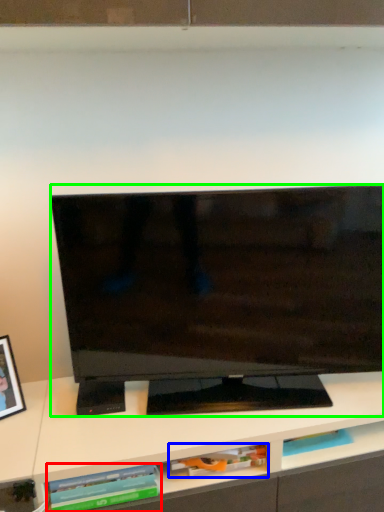
Question: Based on their relative distances, which object is nearer to book (highlighted by a red box)? Choose from book (highlighted by a blue box) and television (highlighted by a green box).

Choices:
 (A) book
 (B) television

Answer: (A)